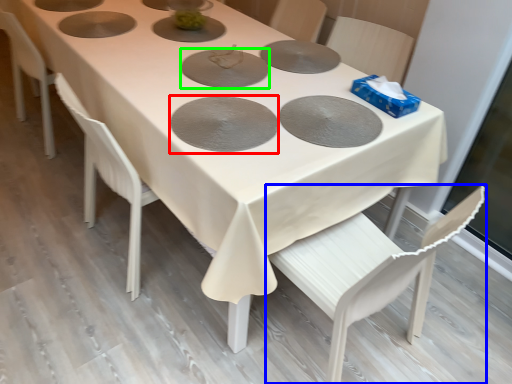
Question: Which is farther away from pizza pan (highlighted by a red box)? chair (highlighted by a blue box) or pizza pan (highlighted by a green box)?

Choices:
 (A) chair
 (B) pizza pan

Answer: (A)